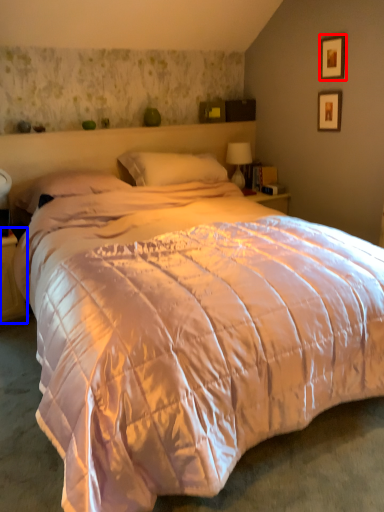
Question: Which point is closer to the camera, picture frame (highlighted by a red box) or nightstand (highlighted by a blue box)?

Choices:
 (A) picture frame
 (B) nightstand

Answer: (B)